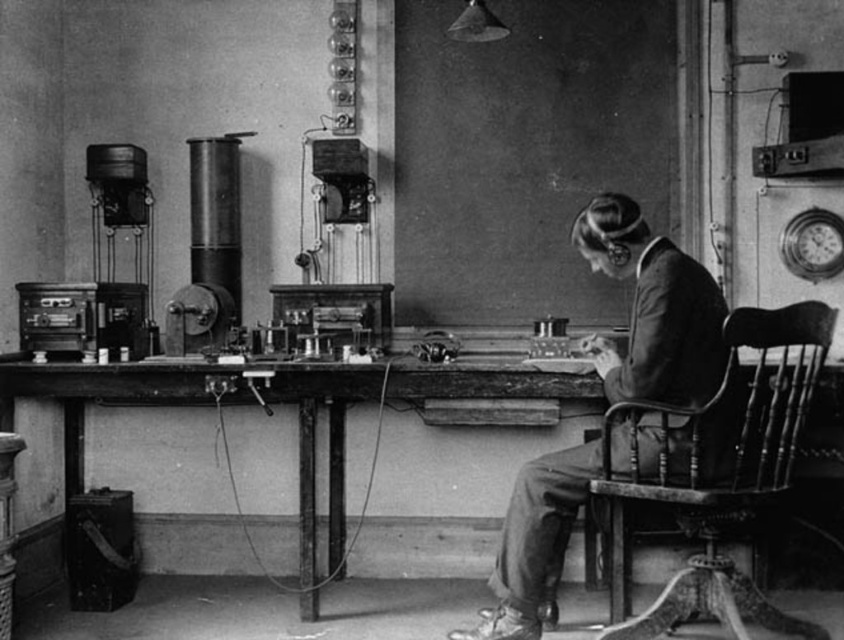
Question: Among these points, which one is nearest to the camera?

Choices:
 (A) (619, 273)
 (B) (659, 403)

Answer: (B)

Question: Which object appears closest to the camera in this image?

Choices:
 (A) smooth leather jacket at center
 (B) wooden chair at right

Answer: (B)

Question: Which of these objects is positioned closest to the wooden table at center?

Choices:
 (A) smooth leather jacket at center
 (B) wooden chair at right

Answer: (A)

Question: From the image, what is the correct spatial relationship of wooden chair at right in relation to wooden table at center?

Choices:
 (A) right
 (B) left

Answer: (A)

Question: Does wooden chair at right have a larger size compared to wooden table at center?

Choices:
 (A) no
 (B) yes

Answer: (A)

Question: Can you confirm if smooth leather jacket at center is wider than wooden table at center?

Choices:
 (A) yes
 (B) no

Answer: (B)